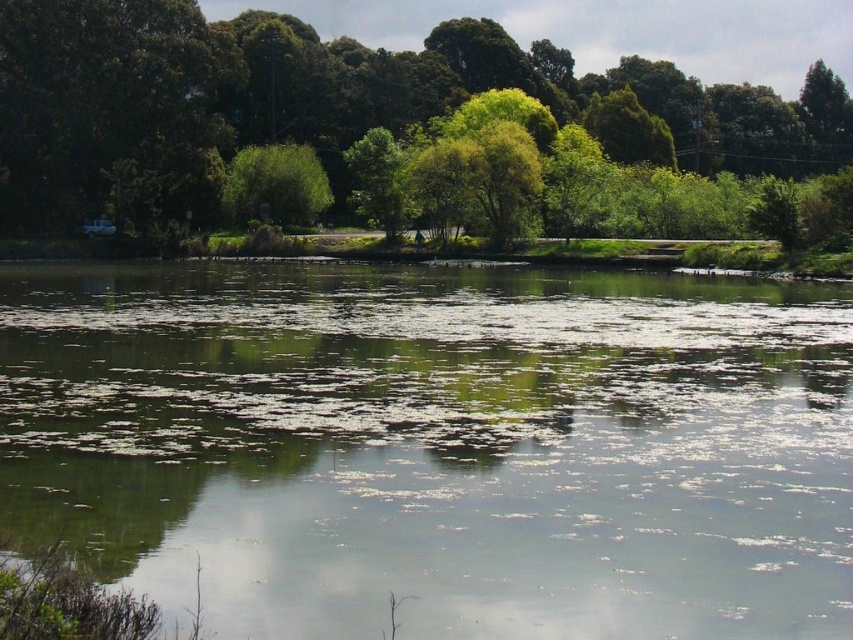
You are standing at the edge of the water and want to throw a pebble to hit both the green algae at center and the green leafy tree at upper center. Which one should you aim for first, the closer one or the farther one?

The green algae at center is closer to you than the green leafy tree at upper center, so you should aim for the green algae at center first since it is the closer target.

You are standing on the edge of the water and see the green algae at center and the green leafy tree at upper center. Which object is closer to your left side?

The green algae at center is to the left of the green leafy tree at upper center, so it is closer to your left side.